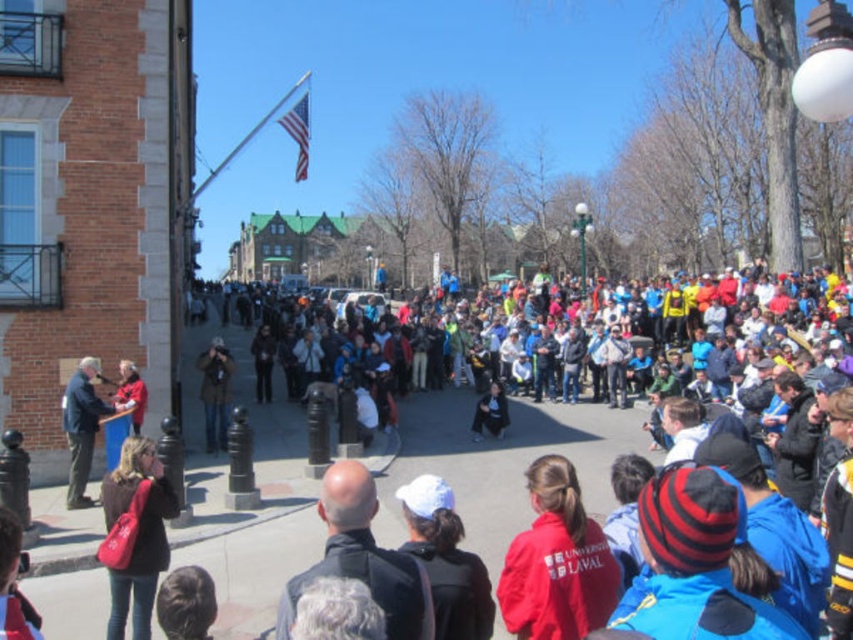
Question: Is red fleece jacket at center closer to the viewer compared to matte brown jacket at lower left?

Choices:
 (A) yes
 (B) no

Answer: (A)

Question: Which of the following is the farthest from the observer?

Choices:
 (A) (152, 522)
 (B) (518, 627)

Answer: (A)

Question: Based on their relative distances, which object is farther from the red fleece jacket at center?

Choices:
 (A) dark blue jacket at left
 (B) matte brown jacket at lower left

Answer: (A)

Question: Considering the real-world distances, which object is closest to the dark blue jacket at left?

Choices:
 (A) matte brown jacket at lower left
 (B) red fleece jacket at center

Answer: (A)

Question: Is red fleece jacket at center behind matte brown jacket at lower left?

Choices:
 (A) yes
 (B) no

Answer: (B)

Question: Does red fleece jacket at center have a larger size compared to dark blue jacket at left?

Choices:
 (A) no
 (B) yes

Answer: (A)